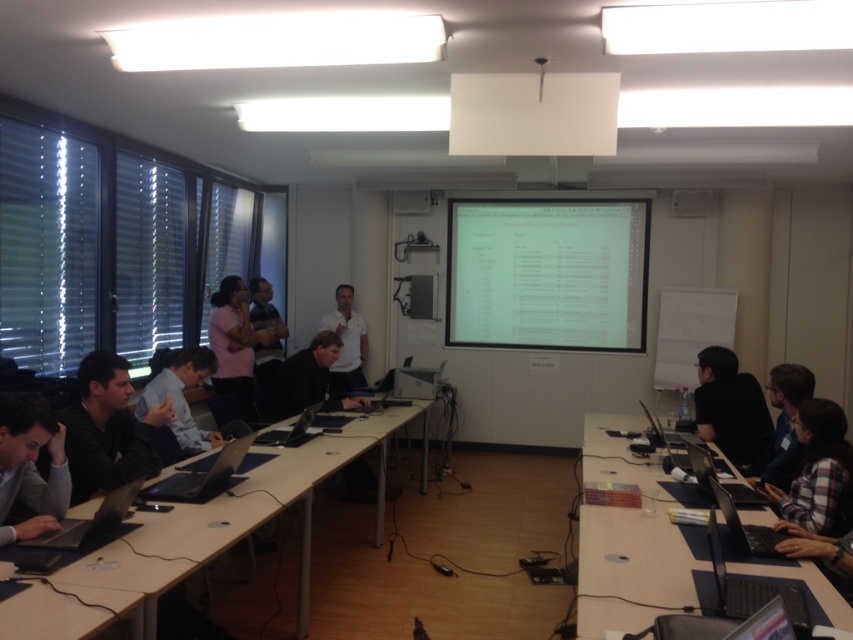
Looking at this image, measure the distance from white matte shirt at center to silver metallic laptop at center.

white matte shirt at center and silver metallic laptop at center are 2.43 meters apart.

Is point (340, 307) farther from camera compared to point (267, 432)?

That is True.

Between point (344, 362) and point (292, 428), which one is positioned in front?

Point (292, 428) is in front.

You are a GUI agent. You are given a task and a screenshot of the screen. Output one action in this format:
    pyautogui.click(x=<x>, y=<y>)
    Task: Click on the white matte shirt at center
    Image resolution: width=853 pixels, height=640 pixels.
    Given the screenshot: What is the action you would take?
    pyautogui.click(x=346, y=340)

Is black shirt at right above matte blue shirt at center?

Incorrect, black shirt at right is not positioned above matte blue shirt at center.

Where is `black shirt at right`? black shirt at right is located at coordinates (730, 406).

Where is `black shirt at right`? black shirt at right is located at coordinates (730, 406).

Measure the distance from black glossy laptop at right to black plastic laptop at right.

black glossy laptop at right is 77.05 centimeters from black plastic laptop at right.

Is black glossy laptop at right above black plastic laptop at right?

Indeed, black glossy laptop at right is positioned over black plastic laptop at right.

Is point (750, 502) positioned after point (642, 403)?

No, (750, 502) is closer to viewer.

Where is `black glossy laptop at right`? black glossy laptop at right is located at coordinates (701, 467).